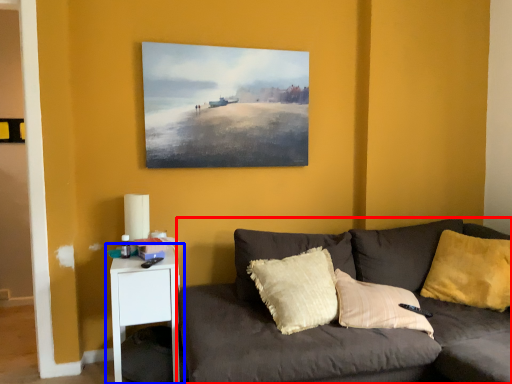
Question: Which object appears farthest to the camera in this image, studio couch (highlighted by a red box) or nightstand (highlighted by a blue box)?

Choices:
 (A) studio couch
 (B) nightstand

Answer: (B)